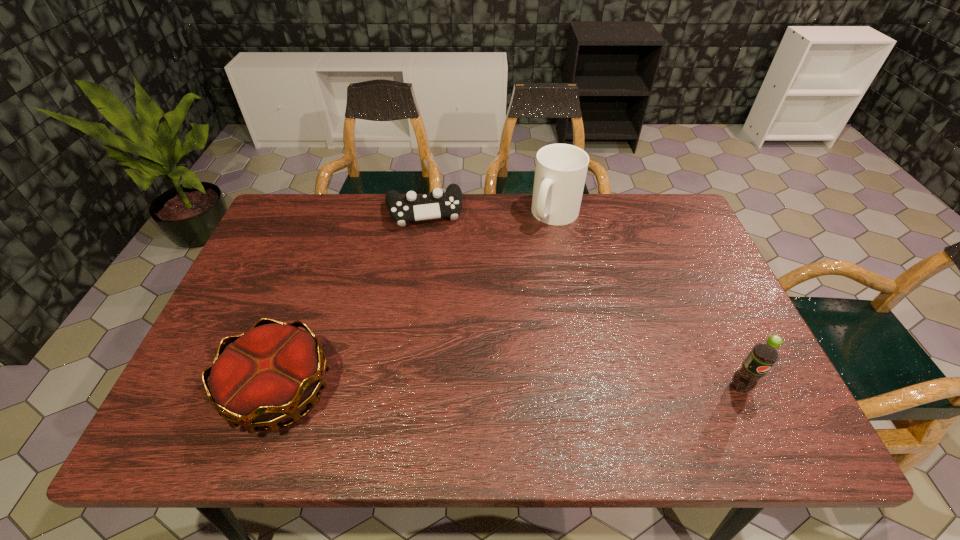
The image size is (960, 540). Find the location of `vacant area that satisfies the following two spatial constraints: 1. on the back side of the third object from right to left; 2. on the right side of the leftmost object`. vacant area that satisfies the following two spatial constraints: 1. on the back side of the third object from right to left; 2. on the right side of the leftmost object is located at coordinates (344, 212).

Where is `vacant space that satisfies the following two spatial constraints: 1. on the front side of the control; 2. on the right side of the mug`? The image size is (960, 540). vacant space that satisfies the following two spatial constraints: 1. on the front side of the control; 2. on the right side of the mug is located at coordinates (423, 214).